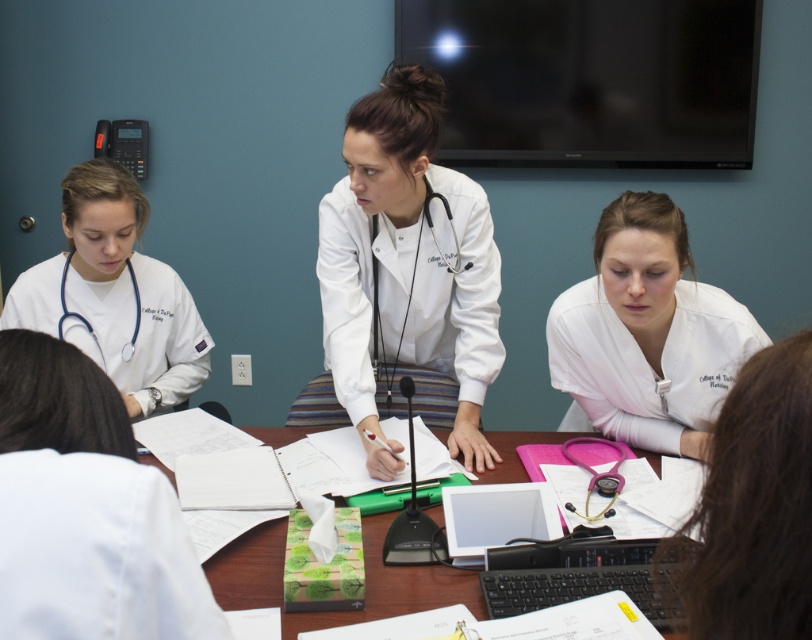
Measure the distance from white smooth stethoscope at lower right to wooden table at center.

white smooth stethoscope at lower right is 29.37 inches away from wooden table at center.

This screenshot has width=812, height=640. Identify the location of white smooth stethoscope at lower right. [x=754, y=506].

Does point (710, 598) come behind point (273, 582)?

No, (710, 598) is closer to viewer.

This screenshot has width=812, height=640. Identify the location of white smooth stethoscope at lower right. (754, 506).

Is white smooth stethoscope at lower right positioned behind white fabric stethoscope at center?

No, white smooth stethoscope at lower right is closer to the viewer.

Describe the element at coordinates (754, 506) in the screenshot. This screenshot has height=640, width=812. I see `white smooth stethoscope at lower right` at that location.

This screenshot has width=812, height=640. I want to click on white smooth stethoscope at lower right, so click(x=754, y=506).

Does point (741, 307) come farther from viewer compared to point (430, 202)?

That is False.

Is point (615, 332) positioned behind point (424, 216)?

No.

Identify the location of white matte uniform at lower right. (648, 332).